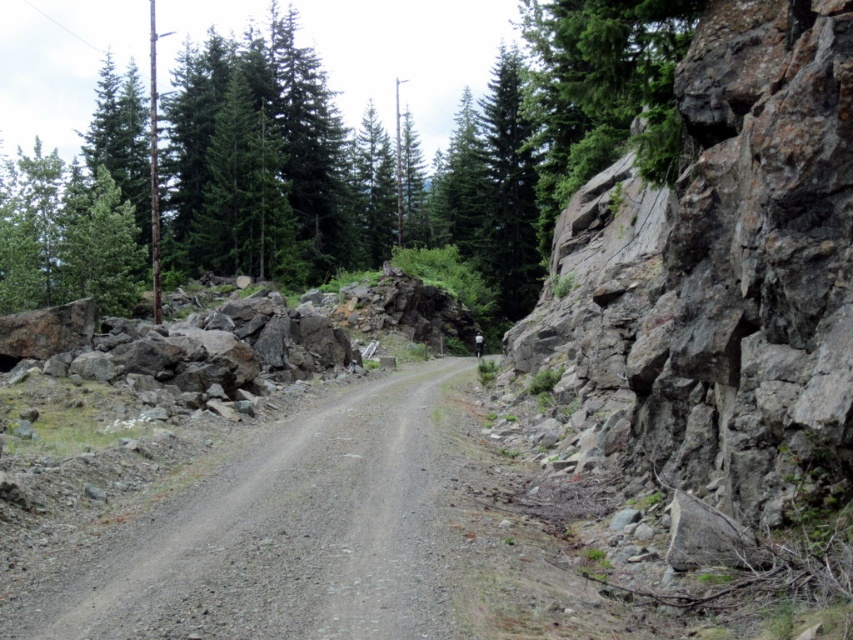
Question: Which point appears farthest from the camera in this image?

Choices:
 (A) (329, 496)
 (B) (119, 163)

Answer: (B)

Question: Does green textured rock at upper right come in front of dirt/gravel mountain path at center?

Choices:
 (A) no
 (B) yes

Answer: (A)

Question: Is green textured rock at upper right closer to the viewer compared to dirt/gravel mountain path at center?

Choices:
 (A) no
 (B) yes

Answer: (A)

Question: Is green textured rock at upper right wider than dirt/gravel mountain path at center?

Choices:
 (A) yes
 (B) no

Answer: (A)